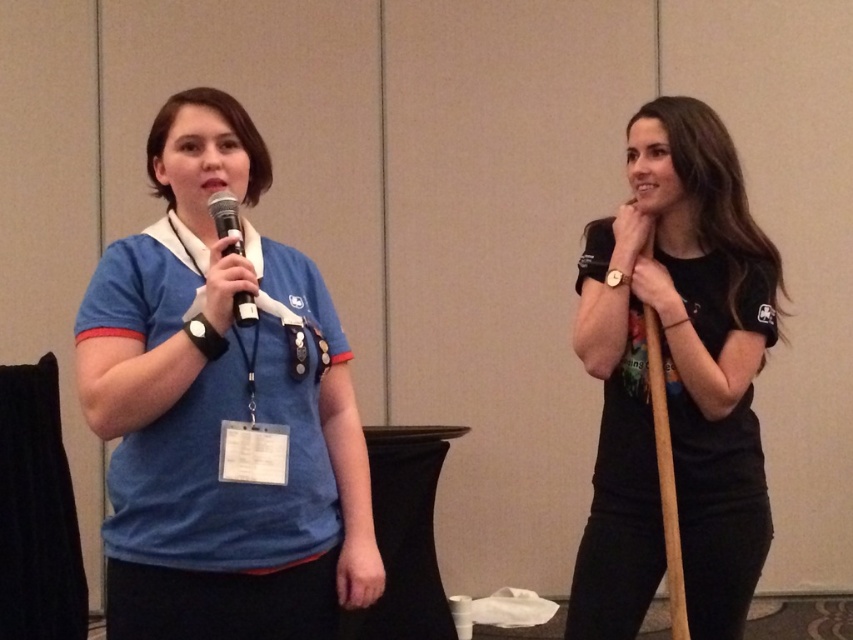
You are an event organizer who needs to arrange seating for the two attendees. Since the blue fabric shirt at left and the black matte shirt at right are standing in a line, which one should you seat first to maintain their original positions?

The blue fabric shirt at left should be seated first because they are positioned over the black matte shirt at right, indicating they are in front and closer to the seating area.

You are organizing a conference and need to arrange the seating for the next speaker. The current setup has the blue fabric shirt at left and the matte black microphone at left. Based on their positions, which object should be placed closer to the center stage?

The blue fabric shirt at left is to the left of the matte black microphone at left, so the matte black microphone at left is closer to the center stage and should be placed closer to the center.

You are organizing a small event and need to ensure that the blue fabric shirt at left and the matte black microphone at left can both fit on a shelf that is 1 meter wide. Can you determine if they will fit together?

The blue fabric shirt at left might be wider than matte black microphone at left, so their combined width could exceed the 1 meter shelf. Without exact measurements, it is uncertain if they will fit together.